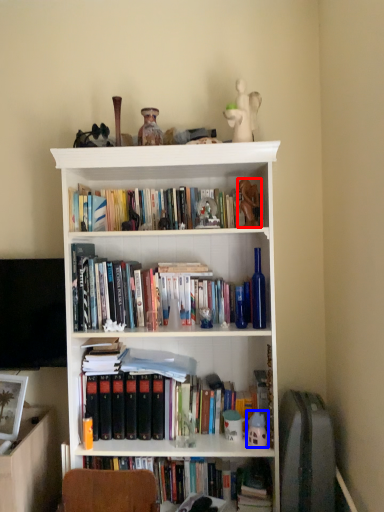
Question: Which of the following is the farthest to the observer, toy (highlighted by a red box) or toy (highlighted by a blue box)?

Choices:
 (A) toy
 (B) toy

Answer: (B)